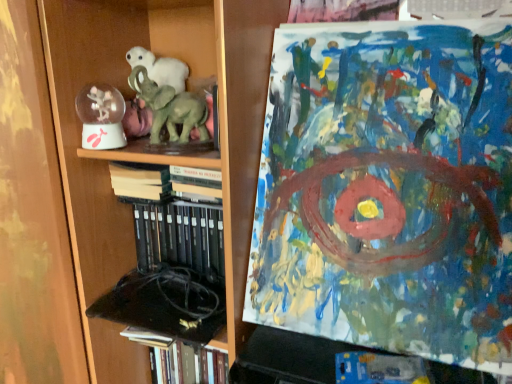
Question: Is point (120, 178) closer or farther from the camera than point (130, 39)?

Choices:
 (A) farther
 (B) closer

Answer: (B)

Question: Do you think hardcover books at center, the 2th book in the bottom-to-top sequence, is within wooden bookcase at left, or outside of it?

Choices:
 (A) outside
 (B) inside

Answer: (B)

Question: Which is nearer to the green matte elephant at center?

Choices:
 (A) wooden bookcase at left
 (B) clear plastic snow globe at left
 (C) hardcover book at lower left, placed as the first book when sorted from bottom to top
 (D) hardcover books at center, the 2th book in the bottom-to-top sequence
 (E) abstract acrylic painting at upper right

Answer: (B)

Question: Which object is the closest to the hardcover book at lower left, placed as the first book when sorted from bottom to top?

Choices:
 (A) green matte elephant at center
 (B) wooden bookcase at left
 (C) abstract acrylic painting at upper right
 (D) clear plastic snow globe at left
 (E) hardcover books at center, the first book positioned from the top

Answer: (B)